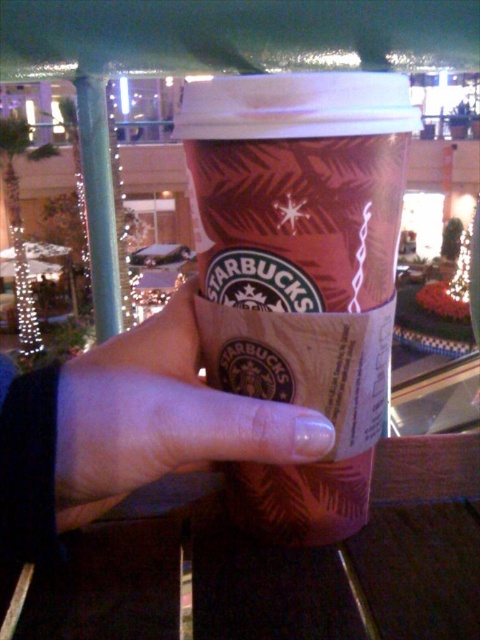
Which is below, matte paper cup at center or nail polish at center?

nail polish at center

The image size is (480, 640). I want to click on matte paper cup at center, so click(300, 269).

This screenshot has width=480, height=640. Describe the element at coordinates (300, 269) in the screenshot. I see `matte paper cup at center` at that location.

Find the location of a particular element. matte paper cup at center is located at coordinates (300, 269).